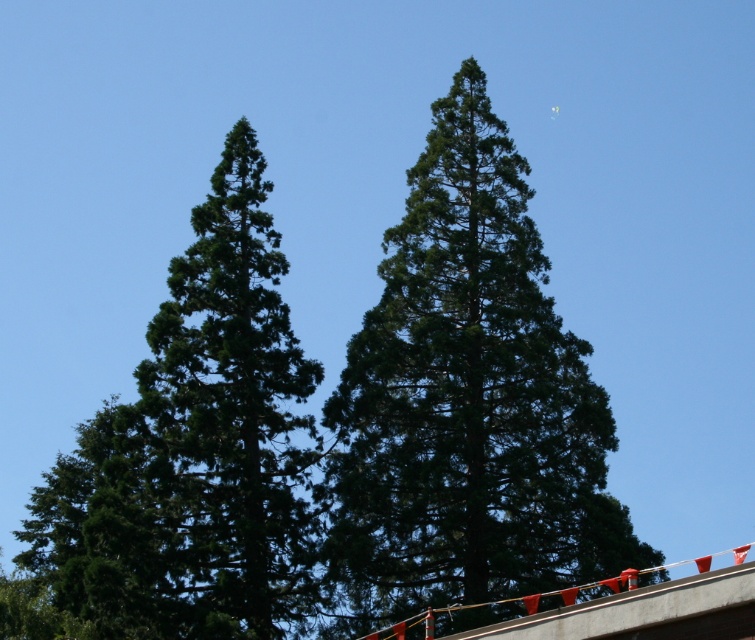
Does green textured tree at center come behind green needle-like at left?

No, green textured tree at center is in front of green needle-like at left.

Can you confirm if green textured tree at center is bigger than green needle-like at left?

No, green textured tree at center is not bigger than green needle-like at left.

What do you see at coordinates (467, 401) in the screenshot? The image size is (755, 640). I see `green textured tree at center` at bounding box center [467, 401].

This screenshot has height=640, width=755. Find the location of `green textured tree at center`. green textured tree at center is located at coordinates (467, 401).